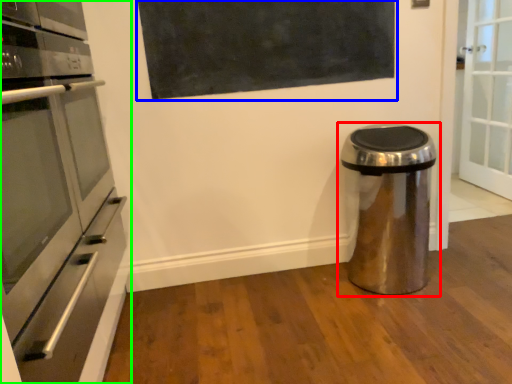
Question: Estimate the real-world distances between objects in this image. Which object is farther from waste container (highlighted by a red box), bulletin board (highlighted by a blue box) or home appliance (highlighted by a green box)?

Choices:
 (A) bulletin board
 (B) home appliance

Answer: (B)